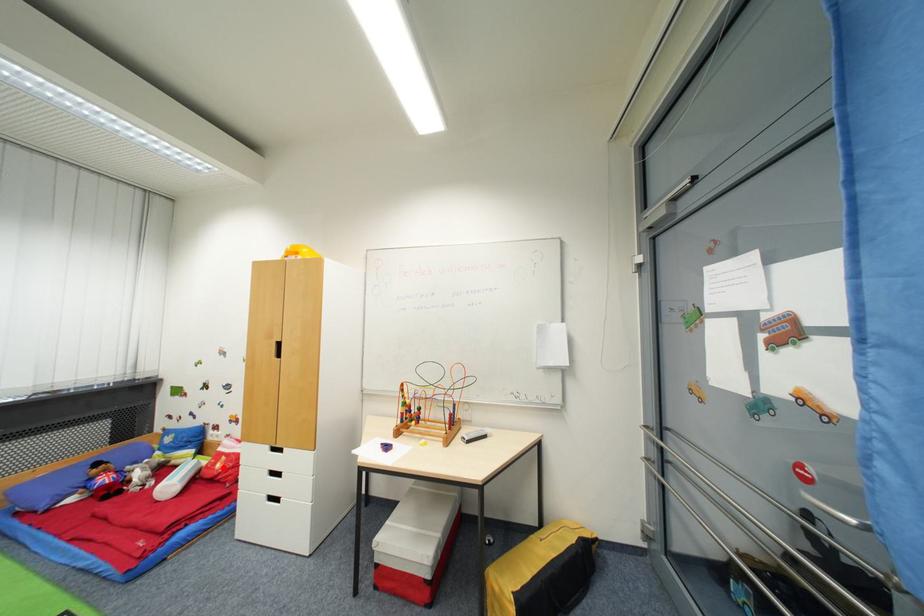
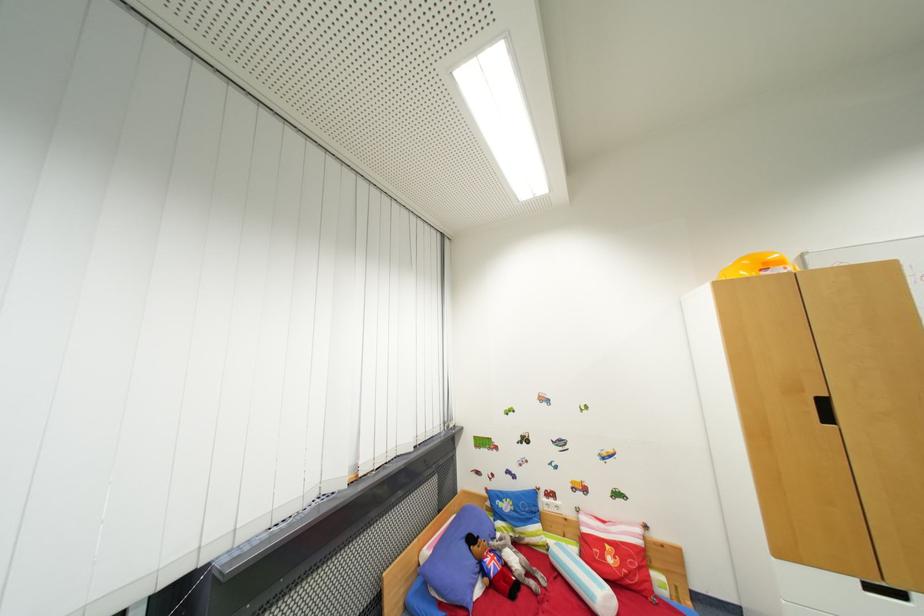
Question: I am providing you with two images of the same scene from different viewpoints. Image1 has a red point marked. In image2, the corresponding 3D location appears at what relative position? Reply with the corresponding letter.

Choices:
 (A) Closer
 (B) Farther

Answer: (A)